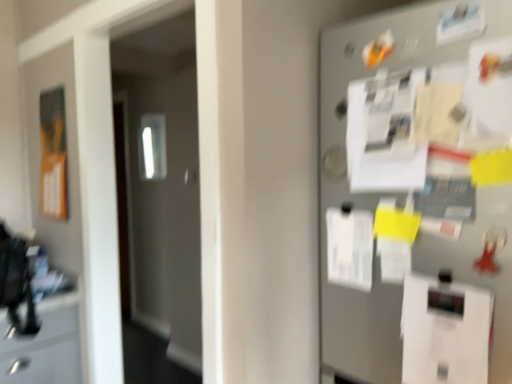
Question: Should I look upward or downward to see transparent glass door at left?

Choices:
 (A) down
 (B) up

Answer: (A)

Question: Is metallic gray fridge at right with white paper at center, placed as the 2th paper when sorted from front to back?

Choices:
 (A) yes
 (B) no

Answer: (B)

Question: Does metallic gray fridge at right have a greater height compared to white paper at center, placed as the 1th paper when sorted from top to bottom?

Choices:
 (A) yes
 (B) no

Answer: (A)

Question: Does metallic gray fridge at right have a smaller size compared to white paper at center, the 1th paper from the left?

Choices:
 (A) yes
 (B) no

Answer: (B)

Question: From the image's perspective, does metallic gray fridge at right appear lower than white paper at center, placed as the 2th paper when sorted from front to back?

Choices:
 (A) yes
 (B) no

Answer: (B)

Question: From the image's perspective, is metallic gray fridge at right located above white paper at center, placed as the 1th paper when sorted from top to bottom?

Choices:
 (A) yes
 (B) no

Answer: (A)

Question: Is metallic gray fridge at right at the right side of white paper at center, which ranks as the second paper in bottom-to-top order?

Choices:
 (A) yes
 (B) no

Answer: (A)

Question: Can you confirm if white paper at center, the 1th paper from the left, is taller than metallic gray fridge at right?

Choices:
 (A) no
 (B) yes

Answer: (A)

Question: Does white paper at center, the 1th paper positioned from the back, have a greater width compared to metallic gray fridge at right?

Choices:
 (A) no
 (B) yes

Answer: (A)

Question: Is white paper at center, placed as the 1th paper when sorted from top to bottom, turned away from metallic gray fridge at right?

Choices:
 (A) yes
 (B) no

Answer: (A)

Question: From a real-world perspective, is white paper at center, placed as the 1th paper when sorted from top to bottom, positioned over metallic gray fridge at right based on gravity?

Choices:
 (A) no
 (B) yes

Answer: (A)

Question: Does white paper at center, arranged as the second paper when viewed from the right, appear on the left side of metallic gray fridge at right?

Choices:
 (A) yes
 (B) no

Answer: (A)

Question: Is white paper at center, placed as the 1th paper when sorted from top to bottom, further to camera compared to metallic gray fridge at right?

Choices:
 (A) no
 (B) yes

Answer: (B)

Question: Is orange matte poster at left completely or partially outside of white paper at center, placed as the 2th paper when sorted from front to back?

Choices:
 (A) no
 (B) yes

Answer: (B)